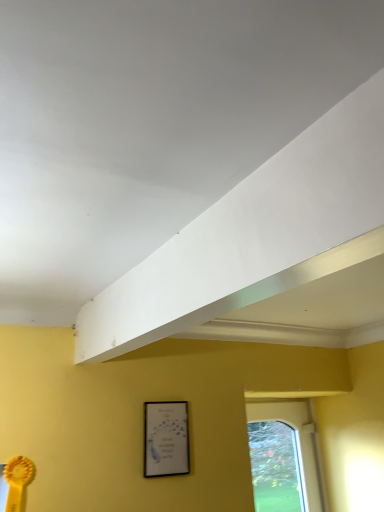
What do you see at coordinates (268, 251) in the screenshot? I see `white matte exhaust hood at upper center` at bounding box center [268, 251].

Image resolution: width=384 pixels, height=512 pixels. What are the coordinates of `clear glass window at lower right` in the screenshot? It's located at (282, 457).

At what (x,y) coordinates should I click in order to perform the action: click on white matte exhaust hood at upper center. Please return your answer as a coordinate pair (x, y). Looking at the image, I should click on (268, 251).

From the image's perspective, which object appears higher, clear glass window at lower right or white matte exhaust hood at upper center?

white matte exhaust hood at upper center, from the image's perspective.

Considering the relative positions of clear glass window at lower right and white matte exhaust hood at upper center in the image provided, is clear glass window at lower right to the right of white matte exhaust hood at upper center from the viewer's perspective?

Yes, clear glass window at lower right is to the right of white matte exhaust hood at upper center.

From a real-world perspective, who is located higher, clear glass window at lower right or white matte exhaust hood at upper center?

From a 3D spatial view, white matte exhaust hood at upper center is above.

At what (x,y) coordinates should I click in order to perform the action: click on exhaust hood that is above the matte black picture frame at lower center (from a real-world perspective). Please return your answer as a coordinate pair (x, y). This screenshot has height=512, width=384. Looking at the image, I should click on (268, 251).

Which point is more forward, (x=226, y=315) or (x=175, y=458)?

The point (x=175, y=458) is closer to the camera.

From the image's perspective, which one is positioned higher, white matte exhaust hood at upper center or matte black picture frame at lower center?

white matte exhaust hood at upper center appears higher in the image.

Is matte black picture frame at lower center at the back of white matte exhaust hood at upper center?

No, white matte exhaust hood at upper center's orientation is not away from matte black picture frame at lower center.

Measure the distance from clear glass window at lower right to matte black picture frame at lower center.

clear glass window at lower right and matte black picture frame at lower center are 3.69 feet apart.

From the image's perspective, relative to matte black picture frame at lower center, is clear glass window at lower right above or below?

From the image's perspective, clear glass window at lower right appears below matte black picture frame at lower center.

Is clear glass window at lower right not close to matte black picture frame at lower center?

That's right, there is a large distance between clear glass window at lower right and matte black picture frame at lower center.

Considering the sizes of matte black picture frame at lower center and clear glass window at lower right in the image, is matte black picture frame at lower center taller or shorter than clear glass window at lower right?

Considering their sizes, matte black picture frame at lower center has less height than clear glass window at lower right.

From the picture: Who is more distant, matte black picture frame at lower center or clear glass window at lower right?

clear glass window at lower right is behind.

Is clear glass window at lower right at the back of matte black picture frame at lower center?

matte black picture frame at lower center does not have its back to clear glass window at lower right.

Does white matte exhaust hood at upper center turn towards clear glass window at lower right?

No.

Which of these two, white matte exhaust hood at upper center or clear glass window at lower right, stands taller?

With more height is clear glass window at lower right.

Considering the relative sizes of white matte exhaust hood at upper center and clear glass window at lower right in the image provided, is white matte exhaust hood at upper center bigger than clear glass window at lower right?

No.

From a real-world perspective, who is located higher, white matte exhaust hood at upper center or clear glass window at lower right?

From a 3D spatial view, white matte exhaust hood at upper center is above.

Measure the distance between matte black picture frame at lower center and white matte exhaust hood at upper center.

matte black picture frame at lower center is 26.62 inches from white matte exhaust hood at upper center.

Is white matte exhaust hood at upper center surrounded by matte black picture frame at lower center?

Definitely not — white matte exhaust hood at upper center is not inside matte black picture frame at lower center.

Looking at their sizes, would you say matte black picture frame at lower center is wider or thinner than white matte exhaust hood at upper center?

matte black picture frame at lower center is thinner than white matte exhaust hood at upper center.

From a real-world perspective, is matte black picture frame at lower center physically above white matte exhaust hood at upper center?

No.

The height and width of the screenshot is (512, 384). Identify the location of window that appears on the right of white matte exhaust hood at upper center. (282, 457).

Image resolution: width=384 pixels, height=512 pixels. I want to click on picture frame that is on the left side of white matte exhaust hood at upper center, so click(x=166, y=439).

Consider the image. Estimate the real-world distances between objects in this image. Which object is closer to white matte exhaust hood at upper center, matte black picture frame at lower center or clear glass window at lower right?

matte black picture frame at lower center.

Estimate the real-world distances between objects in this image. Which object is further from clear glass window at lower right, white matte exhaust hood at upper center or matte black picture frame at lower center?

white matte exhaust hood at upper center lies further to clear glass window at lower right than the other object.

Looking at the image, which one is located closer to matte black picture frame at lower center, white matte exhaust hood at upper center or clear glass window at lower right?

white matte exhaust hood at upper center lies closer to matte black picture frame at lower center than the other object.

Considering their positions, is clear glass window at lower right positioned further to white matte exhaust hood at upper center than matte black picture frame at lower center?

The object further to white matte exhaust hood at upper center is clear glass window at lower right.

Estimate the real-world distances between objects in this image. Which object is further from clear glass window at lower right, matte black picture frame at lower center or white matte exhaust hood at upper center?

white matte exhaust hood at upper center is further to clear glass window at lower right.

From the image, which object appears to be nearer to matte black picture frame at lower center, clear glass window at lower right or white matte exhaust hood at upper center?

The object closer to matte black picture frame at lower center is white matte exhaust hood at upper center.

You are a GUI agent. You are given a task and a screenshot of the screen. Output one action in this format:
    pyautogui.click(x=<x>, y=<y>)
    Task: Click on the picture frame positioned between white matte exhaust hood at upper center and clear glass window at lower right from near to far
    Image resolution: width=384 pixels, height=512 pixels.
    Given the screenshot: What is the action you would take?
    pyautogui.click(x=166, y=439)